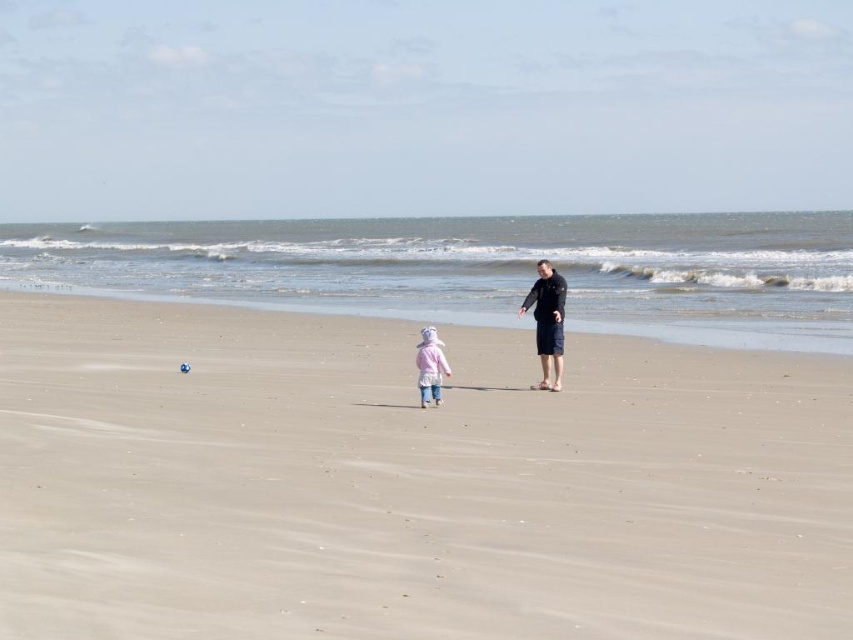
Between point (607, 317) and point (537, 323), which one is positioned behind?

The point (607, 317) is more distant.

Where is `smooth sand at shoreline center`? This screenshot has width=853, height=640. smooth sand at shoreline center is located at coordinates [724, 326].

Who is taller, dark blue fabric shorts at center or pink fleece jacket at center?

dark blue fabric shorts at center is taller.

Who is more forward, (548, 321) or (440, 352)?

Point (440, 352)

Is point (554, 304) positioned in front of point (427, 392)?

No, (554, 304) is further to viewer.

Identify the location of dark blue fabric shorts at center. This screenshot has width=853, height=640. (547, 321).

Is smooth sand at center further to camera compared to pink fleece jacket at center?

No, smooth sand at center is in front of pink fleece jacket at center.

Can you confirm if smooth sand at center is positioned below pink fleece jacket at center?

Yes.

This screenshot has height=640, width=853. In order to click on smooth sand at center in this screenshot , I will do `click(409, 483)`.